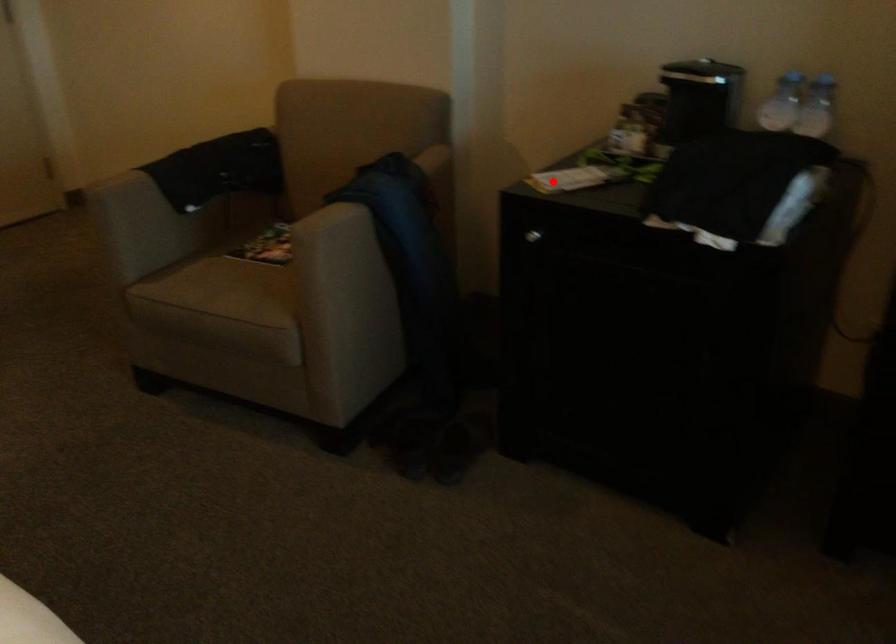
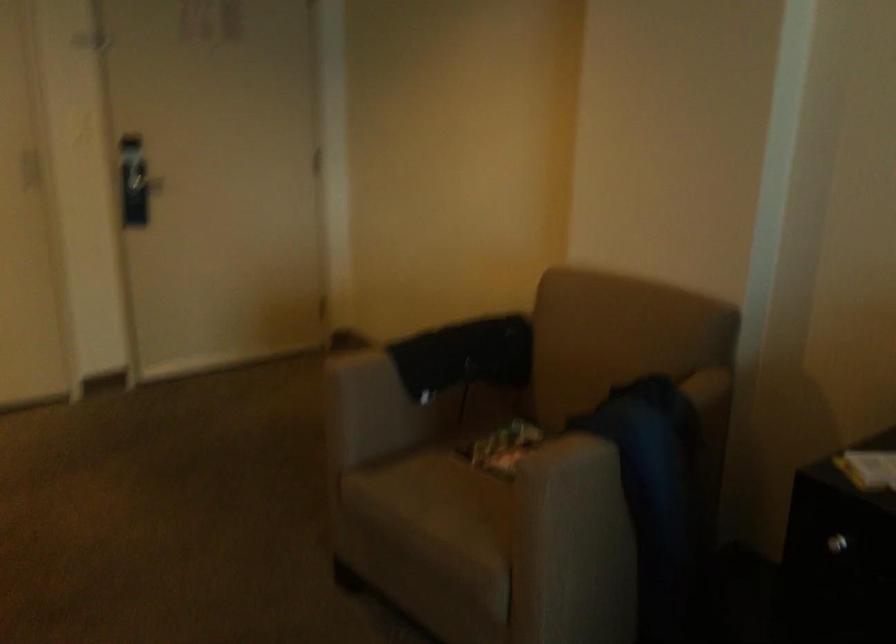
Where in the second image is the point corresponding to the highlighted location from the first image?

(871, 469)